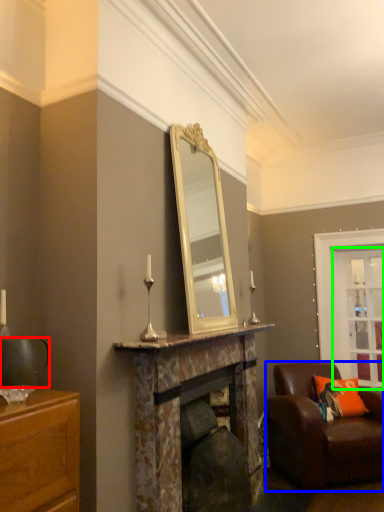
Question: Estimate the real-world distances between objects in this image. Which object is closer to coffee cup (highlighted by a red box), chair (highlighted by a blue box) or glass door (highlighted by a green box)?

Choices:
 (A) chair
 (B) glass door

Answer: (A)